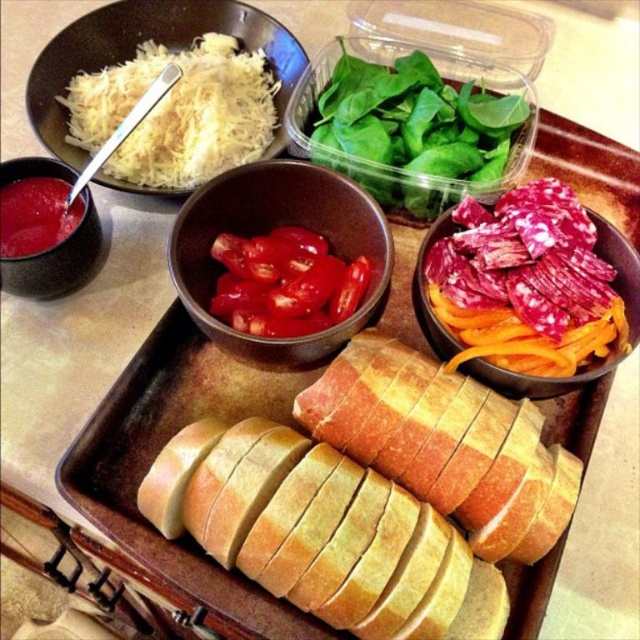
Does golden brown crusty bread at center have a lesser height compared to sliced tomatoes in matte bowl at center?

Indeed, golden brown crusty bread at center has a lesser height compared to sliced tomatoes in matte bowl at center.

Can you confirm if golden brown crusty bread at center is wider than sliced tomatoes in matte bowl at center?

Yes, golden brown crusty bread at center is wider than sliced tomatoes in matte bowl at center.

Does point (211, 480) come farther from viewer compared to point (198, 202)?

No.

Where is `golden brown crusty bread at center`? This screenshot has height=640, width=640. golden brown crusty bread at center is located at coordinates (321, 532).

How distant is white matte shredded cheese at upper left from matte red sauce at upper left?

white matte shredded cheese at upper left is 8.21 inches away from matte red sauce at upper left.

Who is positioned more to the right, white matte shredded cheese at upper left or matte red sauce at upper left?

white matte shredded cheese at upper left is more to the right.

Between point (275, 106) and point (10, 241), which one is positioned in front?

Point (10, 241) is more forward.

At what (x,y) coordinates should I click in order to perform the action: click on white matte shredded cheese at upper left. Please return your answer as a coordinate pair (x, y). This screenshot has height=640, width=640. Looking at the image, I should click on (156, 42).

Is point (401, 104) positioned behind point (252, 296)?

Yes.

Can you confirm if green leafy spinach at upper center is positioned to the right of bright red tomato at center?

Indeed, green leafy spinach at upper center is positioned on the right side of bright red tomato at center.

Does point (396, 125) come closer to viewer compared to point (227, 268)?

No, (396, 125) is behind (227, 268).

Locate an element on the screen. green leafy spinach at upper center is located at coordinates (419, 124).